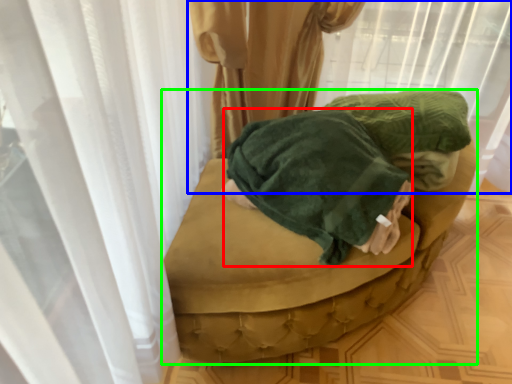
Question: Estimate the real-world distances between objects in this image. Which object is closer to clothing (highlighted by a red box), curtain (highlighted by a blue box) or furniture (highlighted by a green box)?

Choices:
 (A) curtain
 (B) furniture

Answer: (B)